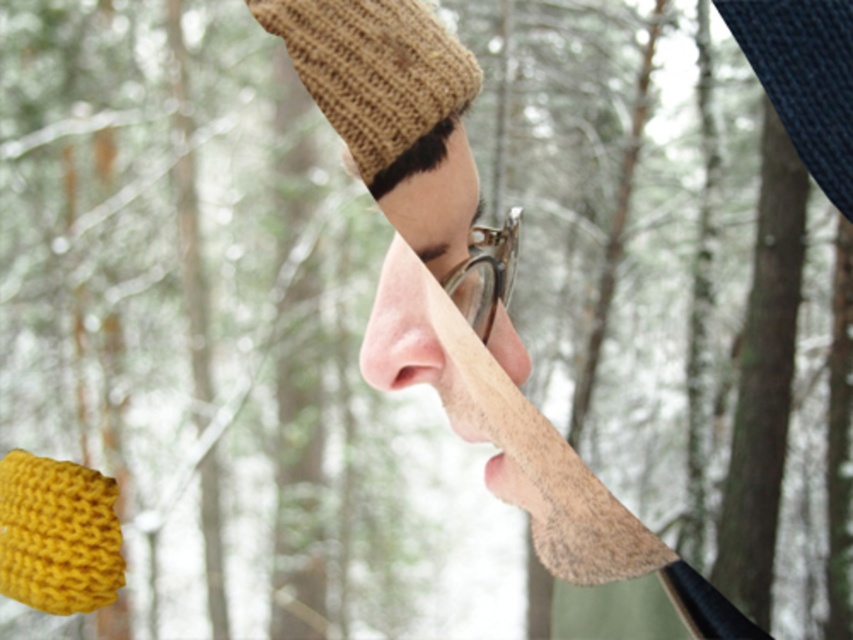
Who is more forward, (93, 547) or (405, 365)?

Point (405, 365) is in front.

Can you confirm if knitted yellow scarf at lower left is positioned below pink smooth nose at center?

Yes, knitted yellow scarf at lower left is below pink smooth nose at center.

Which is behind, point (94, 579) or point (439, 376)?

The point (94, 579) is more distant.

The image size is (853, 640). I want to click on knitted yellow scarf at lower left, so click(x=57, y=534).

Between knitted brown hat at upper center and smooth skin nose at center, which one appears on the right side from the viewer's perspective?

From the viewer's perspective, smooth skin nose at center appears more on the right side.

Does knitted brown hat at upper center have a smaller size compared to smooth skin nose at center?

No, knitted brown hat at upper center is not smaller than smooth skin nose at center.

Describe the element at coordinates (374, 68) in the screenshot. I see `knitted brown hat at upper center` at that location.

At what (x,y) coordinates should I click in order to perform the action: click on knitted brown hat at upper center. Please return your answer as a coordinate pair (x, y). Looking at the image, I should click on (374, 68).

This screenshot has width=853, height=640. What do you see at coordinates (419, 284) in the screenshot?
I see `smooth skin nose at center` at bounding box center [419, 284].

Does smooth skin nose at center have a greater height compared to knitted yellow scarf at lower left?

Correct, smooth skin nose at center is much taller as knitted yellow scarf at lower left.

From the picture: Who is more forward, (476, 188) or (93, 573)?

Point (476, 188)

Image resolution: width=853 pixels, height=640 pixels. Identify the location of smooth skin nose at center. (419, 284).